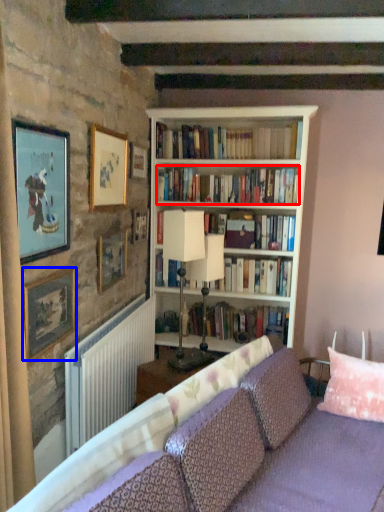
Question: Which point is further to the camera, book (highlighted by a red box) or picture frame (highlighted by a blue box)?

Choices:
 (A) book
 (B) picture frame

Answer: (A)